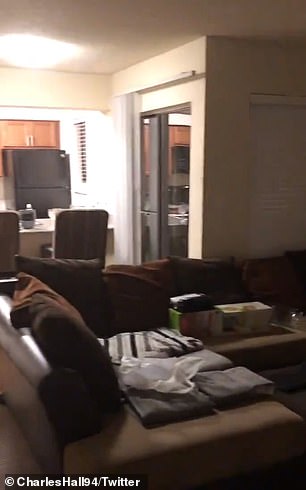
Identify the location of black refridgerator. (41, 179).